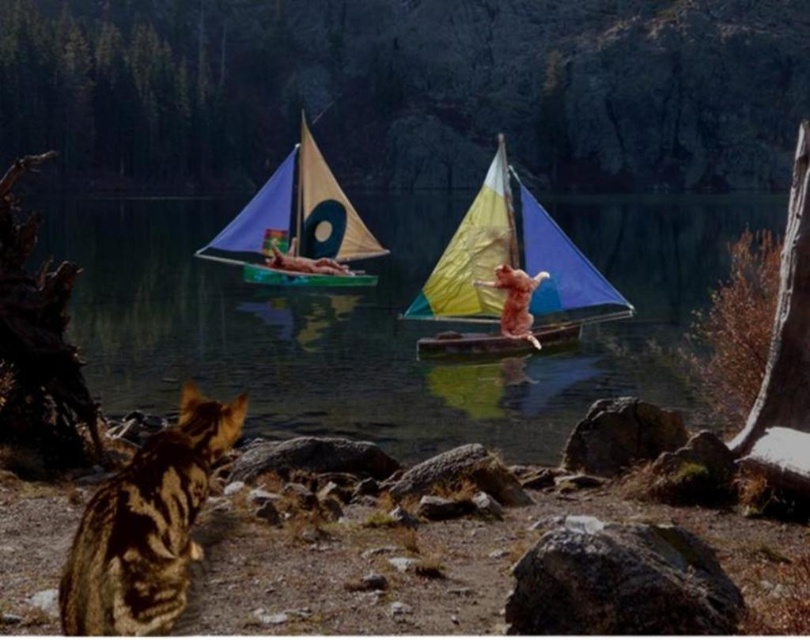
Question: Estimate the real-world distances between objects in this image. Which object is farther from the transparent plastic water at center?

Choices:
 (A) wooden canoe at center
 (B) yellow fabric sailboat at center
 (C) matte yellow sailboat at center
 (D) tabby fur cat at lower left

Answer: (D)

Question: Which object appears closest to the camera in this image?

Choices:
 (A) tabby fur cat at lower left
 (B) matte yellow sailboat at center
 (C) wooden canoe at center
 (D) transparent plastic water at center

Answer: (A)

Question: Which point appears farthest from the camera in this image?

Choices:
 (A) (565, 282)
 (B) (570, 333)
 (C) (100, 634)
 (D) (214, 269)

Answer: (D)

Question: Does transparent plastic water at center have a lesser width compared to tabby fur cat at lower left?

Choices:
 (A) yes
 (B) no

Answer: (B)

Question: Does yellow fabric sailboat at center come in front of matte yellow sailboat at center?

Choices:
 (A) yes
 (B) no

Answer: (A)

Question: Can you confirm if transparent plastic water at center is smaller than tabby fur cat at lower left?

Choices:
 (A) no
 (B) yes

Answer: (A)